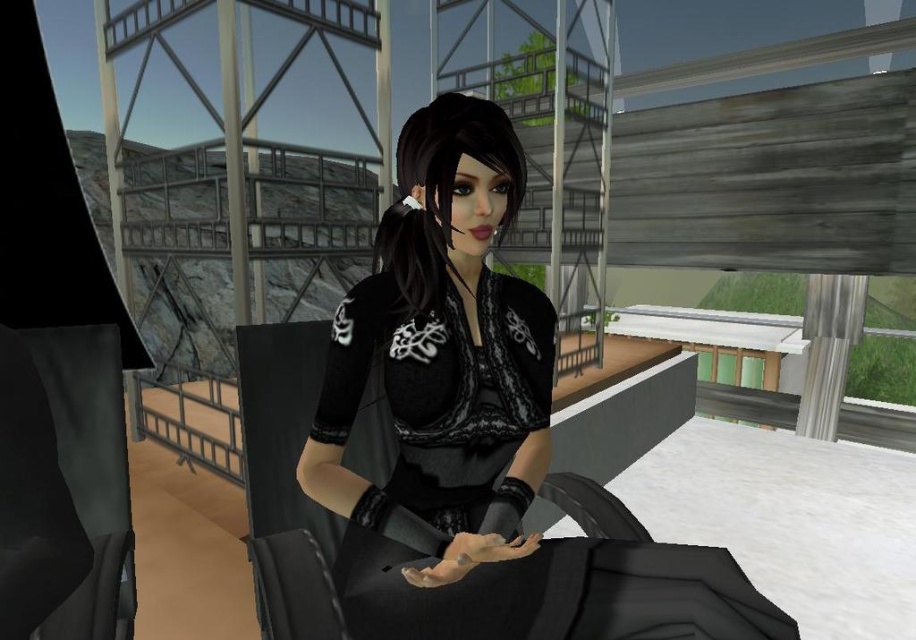
Find the location of `black satin dress at center`. black satin dress at center is located at coordinates (482, 429).

Is black satin dress at center closer to camera compared to black lace dress at center?

Yes, it is in front of black lace dress at center.

Locate an element on the screen. This screenshot has width=916, height=640. black satin dress at center is located at coordinates (482, 429).

Find the location of a particular element. This screenshot has height=640, width=916. black satin dress at center is located at coordinates [x=482, y=429].